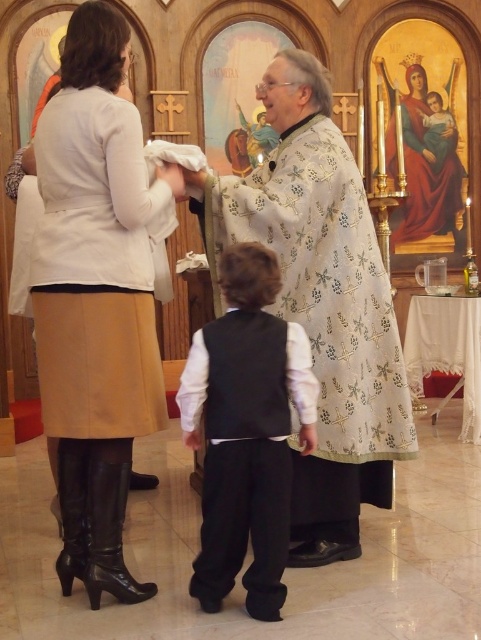
Question: Can you confirm if white embroidered robe at center is positioned to the left of matte gold robe at center?

Choices:
 (A) yes
 (B) no

Answer: (A)

Question: Which point is closer to the camera?

Choices:
 (A) matte gold robe at center
 (B) white embroidered robe at center
 (C) matte beige skirt at lower left

Answer: (C)

Question: Observing the image, what is the correct spatial positioning of white embroidered robe at center in reference to matte gold robe at center?

Choices:
 (A) left
 (B) right

Answer: (A)

Question: Where is black satin vest at center located in relation to matte gold robe at center in the image?

Choices:
 (A) above
 (B) below

Answer: (B)

Question: Which of the following is the farthest from the observer?

Choices:
 (A) (194, 188)
 (B) (405, 104)
 (C) (78, 483)
 (D) (242, 547)

Answer: (B)

Question: Which of the following is the farthest from the observer?

Choices:
 (A) (74, 28)
 (B) (413, 154)

Answer: (B)